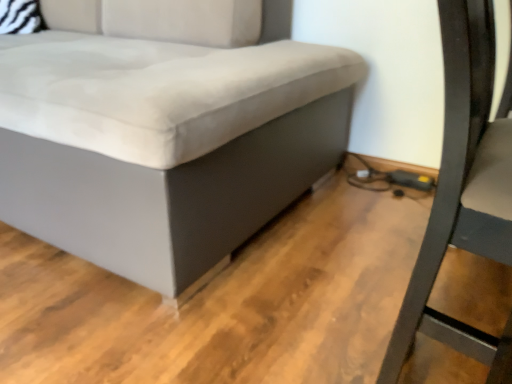
What do you see at coordinates (165, 130) in the screenshot? The width and height of the screenshot is (512, 384). I see `suede-like beige studio couch at lower left` at bounding box center [165, 130].

Locate an element on the screen. The width and height of the screenshot is (512, 384). suede-like beige studio couch at lower left is located at coordinates (165, 130).

You are a GUI agent. You are given a task and a screenshot of the screen. Output one action in this format:
    pyautogui.click(x=<x>, y=<y>)
    Task: Click on the suede-like beige studio couch at lower left
    Image resolution: width=512 pixels, height=384 pixels.
    Given the screenshot: What is the action you would take?
    pyautogui.click(x=165, y=130)